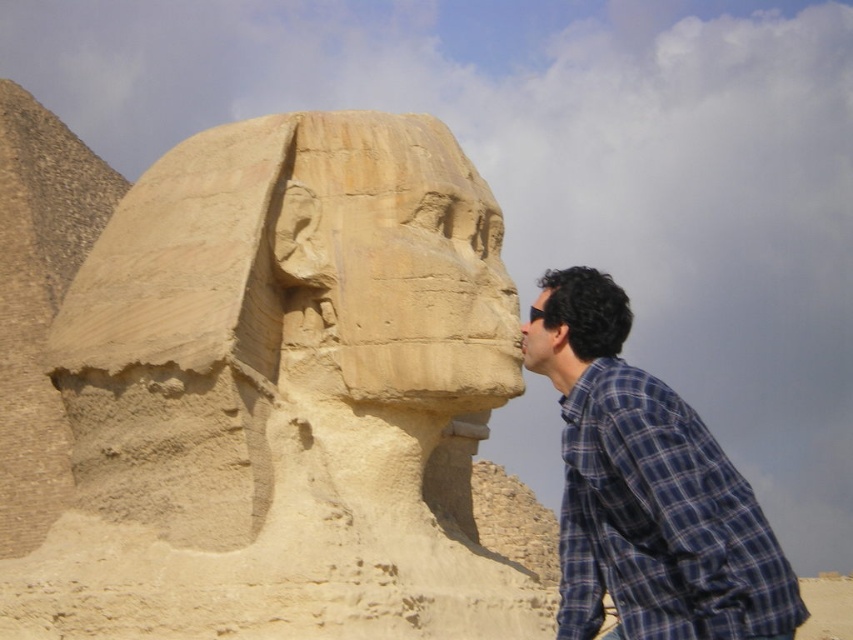
Between matte brown hair at right and matte stone nose at center, which one is positioned lower?

Positioned lower is matte stone nose at center.

Locate an element on the screen. The width and height of the screenshot is (853, 640). matte brown hair at right is located at coordinates (573, 323).

Between point (572, 355) and point (527, 332), which one is positioned in front?

Point (572, 355)

This screenshot has width=853, height=640. In order to click on matte brown hair at right in this screenshot , I will do [x=573, y=323].

Who is higher up, sandstone statue at center or matte brown hair at right?

matte brown hair at right is higher up.

Can you confirm if sandstone statue at center is wider than matte brown hair at right?

Indeed, sandstone statue at center has a greater width compared to matte brown hair at right.

At what (x,y) coordinates should I click in order to perform the action: click on sandstone statue at center. Please return your answer as a coordinate pair (x, y). The height and width of the screenshot is (640, 853). Looking at the image, I should click on (283, 397).

Locate an element on the screen. The height and width of the screenshot is (640, 853). sandstone statue at center is located at coordinates (283, 397).

Where is `sandstone statue at center`? sandstone statue at center is located at coordinates (283, 397).

Is point (228, 570) positioned after point (663, 552)?

Yes, point (228, 570) is farther from viewer.

Is point (361, 221) positioned in front of point (698, 472)?

No.

At what (x,y) coordinates should I click in order to perform the action: click on sandstone statue at center. Please return your answer as a coordinate pair (x, y). Image resolution: width=853 pixels, height=640 pixels. Looking at the image, I should click on (283, 397).